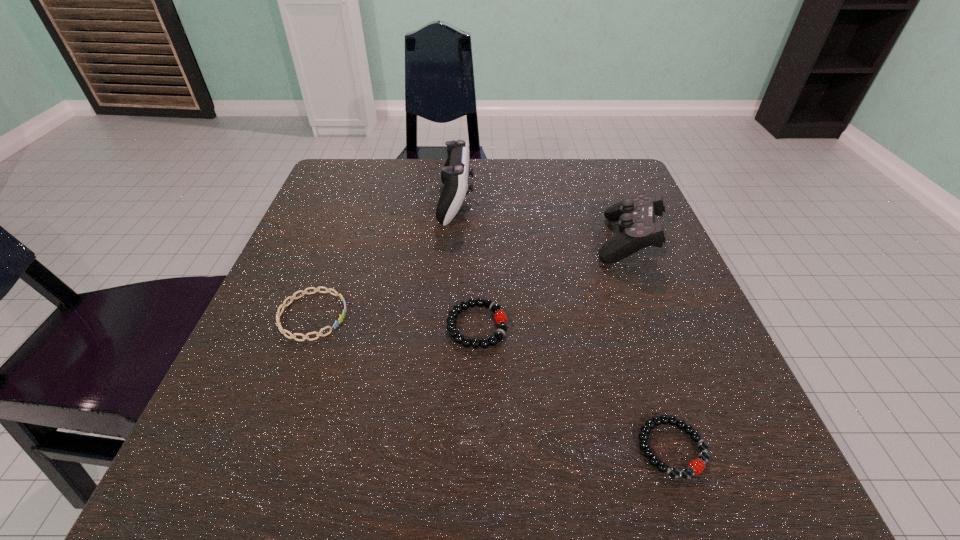
This screenshot has width=960, height=540. I want to click on the taller control, so tap(455, 175).

The image size is (960, 540). I want to click on the left control, so click(455, 175).

The width and height of the screenshot is (960, 540). I want to click on the right control, so click(x=635, y=215).

Locate an element on the screen. the second tallest object is located at coordinates (635, 215).

This screenshot has width=960, height=540. Identify the location of the second bracelet from right to left. (484, 343).

In order to click on the leftmost bracelet in this screenshot , I will do `click(292, 336)`.

This screenshot has width=960, height=540. What are the coordinates of `the nearest object` in the screenshot? It's located at (696, 466).

What are the coordinates of `the rightmost bracelet` in the screenshot? It's located at (696, 466).

The height and width of the screenshot is (540, 960). In order to click on vacant position located on the front-facing side of the taller control in this screenshot , I will do `click(545, 203)`.

Where is `blank space located on the front of the fourth shortest object`? blank space located on the front of the fourth shortest object is located at coordinates (655, 311).